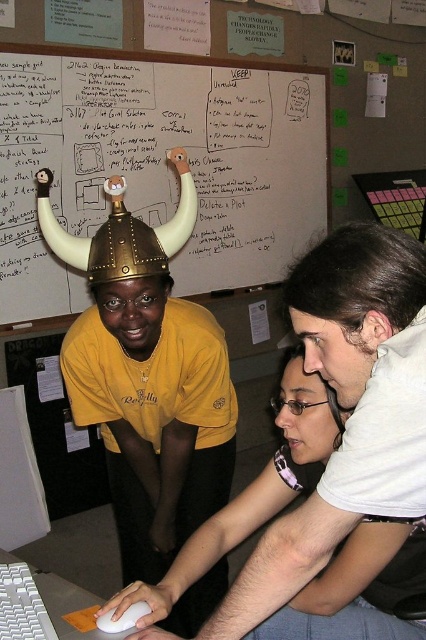
Question: Is white matte mouse at center above white plastic keyboard at lower left?

Choices:
 (A) yes
 (B) no

Answer: (A)

Question: Which point is closer to the camera?

Choices:
 (A) brown hair at center
 (B) white plastic keyboard at lower left
 (C) matte black hair at center
 (D) matte plastic keyboard at upper right

Answer: (A)

Question: Which object is farther from the camera taking this photo?

Choices:
 (A) matte black hair at center
 (B) brown hair at center

Answer: (A)

Question: Estimate the real-world distances between objects in this image. Which object is farther from the matte black hair at center?

Choices:
 (A) whiteboard at upper center
 (B) gold metallic helmet at center
 (C) white matte mouse at center

Answer: (A)

Question: Is white matte mouse at center bigger than white plastic keyboard at lower left?

Choices:
 (A) yes
 (B) no

Answer: (A)

Question: Does gold metallic helmet at center appear on the left side of matte black hair at center?

Choices:
 (A) no
 (B) yes

Answer: (B)